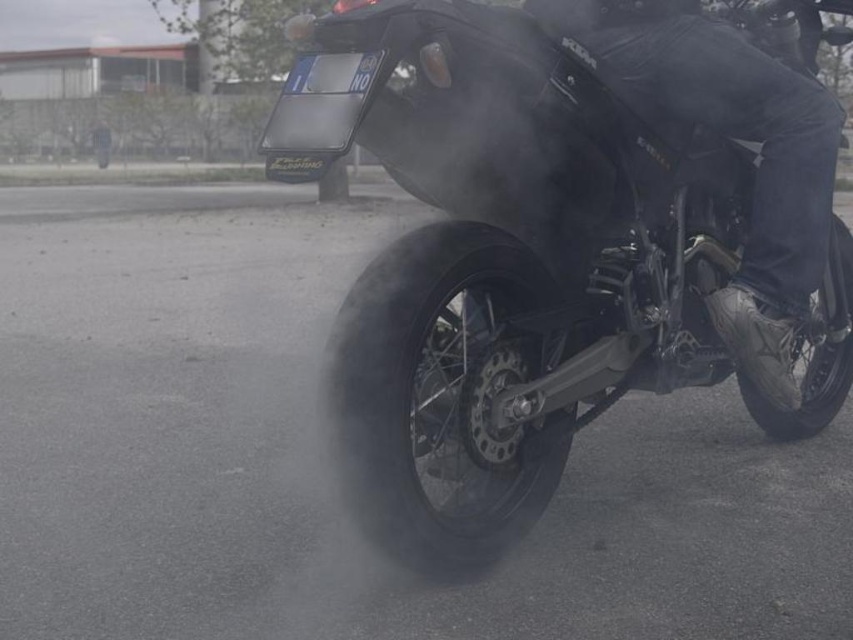
Question: Is black matte motorcycle at center further to camera compared to black rubber tire at lower center?

Choices:
 (A) no
 (B) yes

Answer: (A)

Question: Which of these objects is positioned farthest from the black matte motorcycle at center?

Choices:
 (A) black rubber tire at lower center
 (B) black rubber tire at lower right

Answer: (B)

Question: Is black matte motorcycle at center to the left of black rubber tire at lower right from the viewer's perspective?

Choices:
 (A) no
 (B) yes

Answer: (B)

Question: Does black rubber tire at lower center have a lesser width compared to black rubber tire at lower right?

Choices:
 (A) yes
 (B) no

Answer: (B)

Question: Which point is closer to the camera?

Choices:
 (A) (444, 384)
 (B) (836, 221)
 (C) (631, 342)

Answer: (A)

Question: Which object appears closest to the camera in this image?

Choices:
 (A) black rubber tire at lower right
 (B) black rubber tire at lower center

Answer: (B)